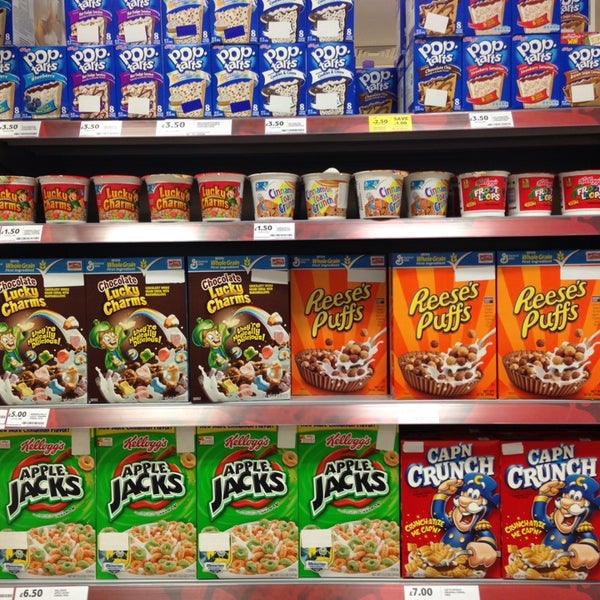
Locate an element on the screen. This screenshot has height=600, width=600. shelves is located at coordinates (134, 597), (169, 415), (152, 228), (147, 127).